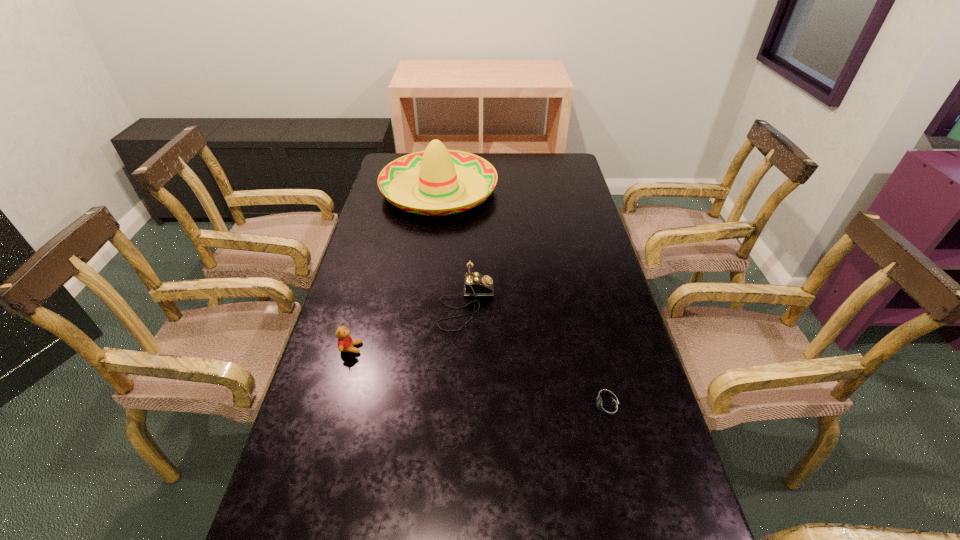
Locate an element on the screen. The width and height of the screenshot is (960, 540). free location located 0.190m on the face of the watch is located at coordinates (502, 407).

The height and width of the screenshot is (540, 960). What are the coordinates of `vacant region located 0.280m on the face of the watch` in the screenshot? It's located at (464, 407).

The width and height of the screenshot is (960, 540). I want to click on object present at the far edge, so click(437, 170).

The height and width of the screenshot is (540, 960). Find the location of `sombrero situated at the left edge`. sombrero situated at the left edge is located at coordinates (437, 170).

Identify the location of teddy bear situated at the left edge. This screenshot has height=540, width=960. (345, 343).

Locate an element on the screen. The image size is (960, 540). object positioned at the right edge is located at coordinates (607, 407).

You are a GUI agent. You are given a task and a screenshot of the screen. Output one action in this format:
    pyautogui.click(x=<x>, y=<y>)
    Task: Click on the object located at the far left corner
    The height and width of the screenshot is (540, 960).
    Given the screenshot: What is the action you would take?
    pyautogui.click(x=437, y=170)

Image resolution: width=960 pixels, height=540 pixels. I want to click on free space at the far edge of the desktop, so click(x=521, y=154).

What are the coordinates of `free point at the left edge` in the screenshot? It's located at (364, 409).

In the image, there is a desktop. Where is `vacant space at the right edge`? This screenshot has width=960, height=540. vacant space at the right edge is located at coordinates (571, 238).